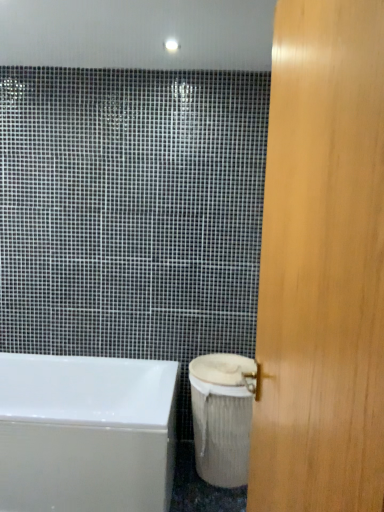
Question: Do you think white glossy bathtub at lower left is within wooden door at right, or outside of it?

Choices:
 (A) outside
 (B) inside

Answer: (A)

Question: From the image's perspective, is white glossy bathtub at lower left located above or below wooden door at right?

Choices:
 (A) above
 (B) below

Answer: (B)

Question: Which is farther from the white glossy bathtub at lower left?

Choices:
 (A) wooden door at right
 (B) white textured toilet bowl at lower right

Answer: (A)

Question: Which is farther from the white glossy bathtub at lower left?

Choices:
 (A) white textured toilet bowl at lower right
 (B) wooden door at right

Answer: (B)